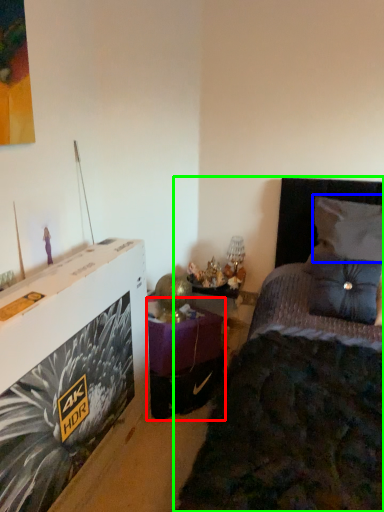
Question: Estimate the real-world distances between objects in this image. Which object is farther from table (highlighted by a red box), pillow (highlighted by a blue box) or bed (highlighted by a green box)?

Choices:
 (A) pillow
 (B) bed

Answer: (A)